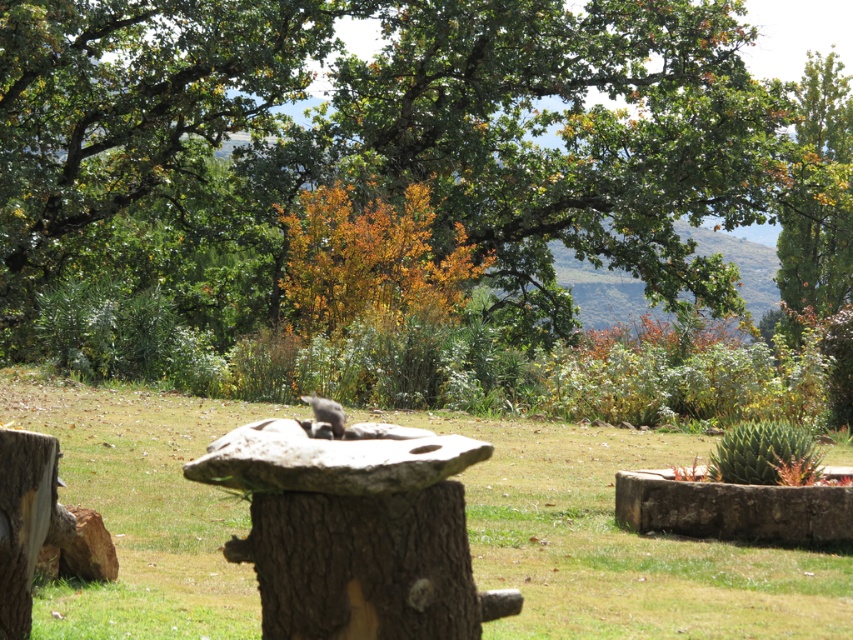
Does smooth stone stump at center appear over brown rough tree trunk at center?

Yes, smooth stone stump at center is above brown rough tree trunk at center.

Locate an element on the screen. smooth stone stump at center is located at coordinates (354, 532).

Describe the element at coordinates (354, 532) in the screenshot. I see `smooth stone stump at center` at that location.

Is point (308, 456) closer to viewer compared to point (795, 141)?

Yes, it is in front of point (795, 141).

Find the location of a particular element. smooth stone stump at center is located at coordinates (354, 532).

Where is `smooth stone stump at center`? The height and width of the screenshot is (640, 853). smooth stone stump at center is located at coordinates (354, 532).

Is point (393, 544) positioned after point (830, 234)?

No, it is in front of (830, 234).

Can you confirm if brown rough tree trunk at center is smaller than green leafy tree at upper right?

Indeed, brown rough tree trunk at center has a smaller size compared to green leafy tree at upper right.

Which is behind, point (378, 616) or point (796, 212)?

Point (796, 212)

Image resolution: width=853 pixels, height=640 pixels. What are the coordinates of `brown rough tree trunk at center` in the screenshot? It's located at (363, 564).